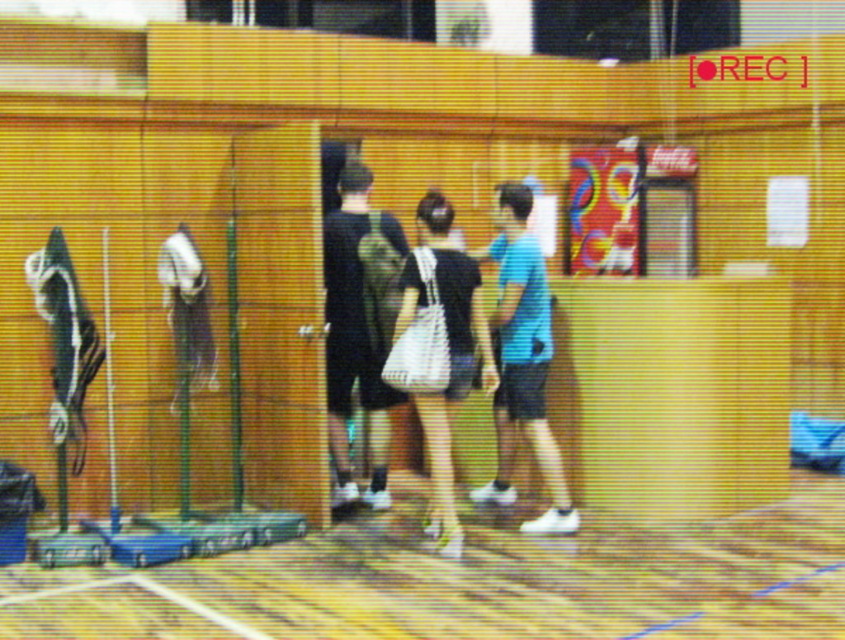
Question: From the image, what is the correct spatial relationship of yellow rubber court at center in relation to black matte bag at center?

Choices:
 (A) left
 (B) right

Answer: (B)

Question: Which point is farther to the camera?

Choices:
 (A) (473, 552)
 (B) (335, 385)
 (C) (533, 422)

Answer: (B)

Question: Which object is the farthest from the black matte bag at center?

Choices:
 (A) dark green fabric backpack at center
 (B) blue matte shirt at center
 (C) yellow rubber court at center

Answer: (C)

Question: Is yellow rubber court at center smaller than dark green fabric backpack at center?

Choices:
 (A) yes
 (B) no

Answer: (B)

Question: Is dark green fabric backpack at center closer to the viewer compared to black matte bag at center?

Choices:
 (A) no
 (B) yes

Answer: (A)

Question: Which object is the closest to the black matte bag at center?

Choices:
 (A) yellow rubber court at center
 (B) blue matte shirt at center
 (C) dark green fabric backpack at center

Answer: (B)